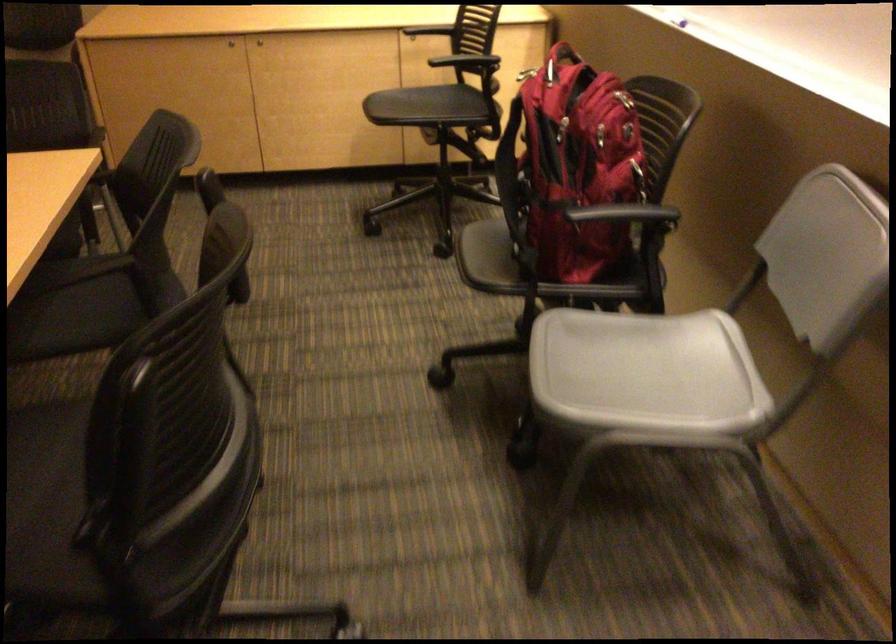
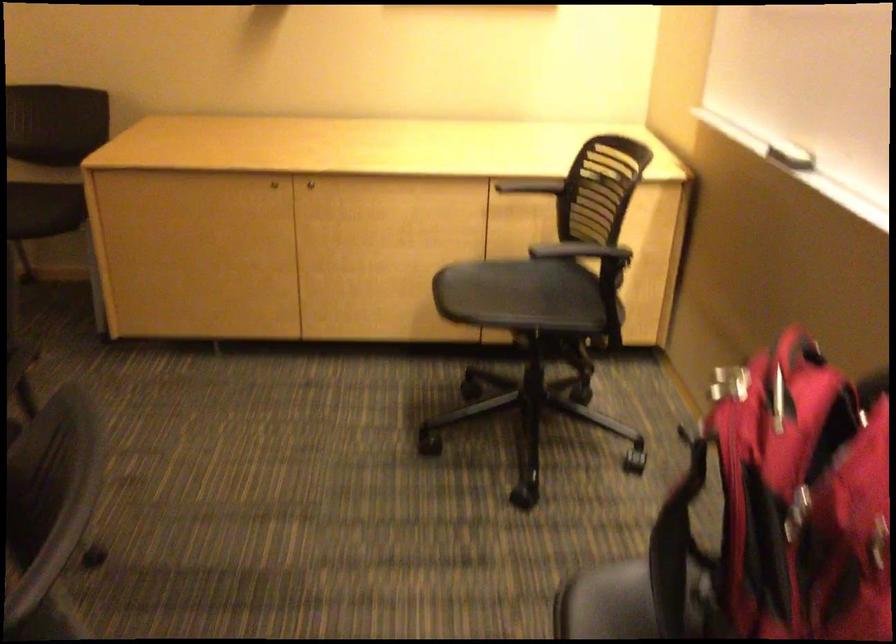
Question: Based on the continuous images, in which direction is the camera rotating? Reply with the corresponding letter.

Choices:
 (A) Left
 (B) Right
 (C) Up
 (D) Down

Answer: (A)